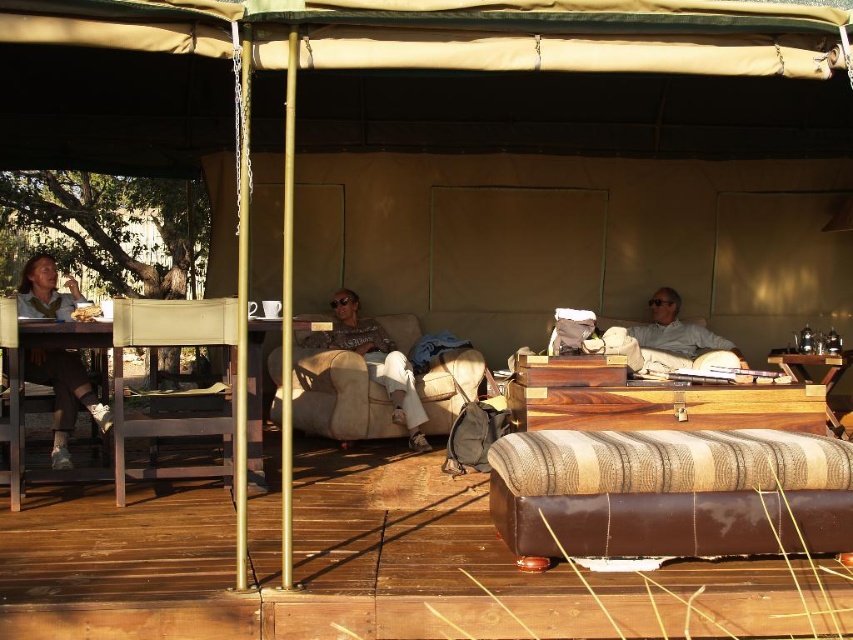
Question: Is brown leather ottoman at lower right positioned behind wooden box at center?

Choices:
 (A) no
 (B) yes

Answer: (A)

Question: Which object appears farthest from the camera in this image?

Choices:
 (A) matte black jacket at left
 (B) beige fabric armchair at center
 (C) wooden box at center
 (D) metallic silver armchair at left

Answer: (B)

Question: Which point is closer to the camera?

Choices:
 (A) light gray fabric couch at right
 (B) metallic silver armchair at left

Answer: (B)

Question: Does brown leather ottoman at lower right lie behind light gray fabric couch at right?

Choices:
 (A) yes
 (B) no

Answer: (B)

Question: Among these objects, which one is nearest to the camera?

Choices:
 (A) brown leather ottoman at lower right
 (B) metallic silver armchair at left
 (C) matte gray sweater at center
 (D) wooden box at center

Answer: (A)

Question: Can you confirm if metallic silver armchair at left is positioned above light gray fabric couch at right?

Choices:
 (A) yes
 (B) no

Answer: (B)